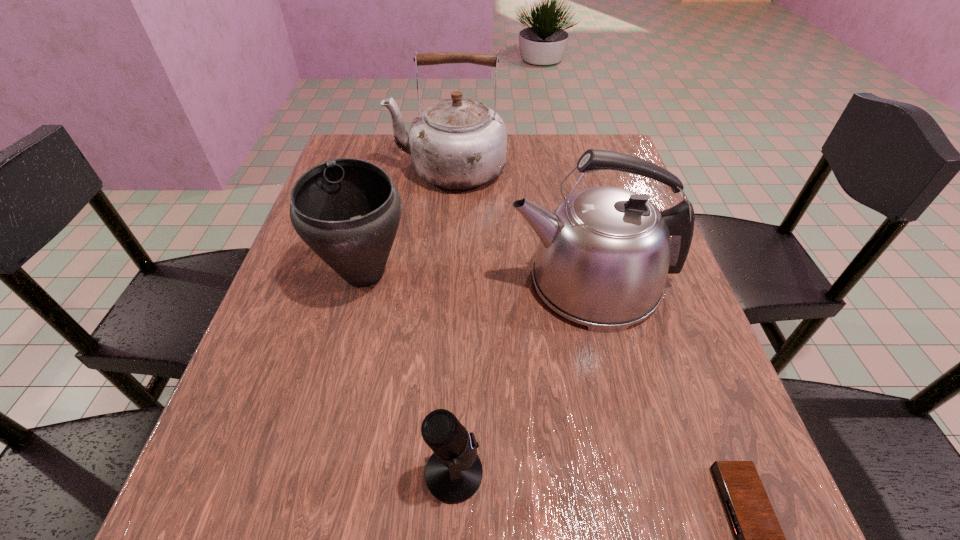
Locate an element on the screen. blank area located on the front of the urn is located at coordinates (344, 356).

Find the location of a particular element. The image size is (960, 540). free space located 0.120m on the stand of the second shortest object is located at coordinates (565, 473).

Find the location of a particular element. object located in the far edge section of the desktop is located at coordinates (458, 143).

Where is `object at the near edge`? object at the near edge is located at coordinates (453, 474).

The image size is (960, 540). What are the coordinates of `kettle at the left edge` in the screenshot? It's located at (x=458, y=143).

Find the location of a particular element. This screenshot has width=960, height=540. urn present at the left edge is located at coordinates (347, 210).

The height and width of the screenshot is (540, 960). In order to click on object present at the right edge in this screenshot , I will do `click(604, 254)`.

In order to click on object at the far left corner in this screenshot , I will do `click(458, 143)`.

Locate an element on the screen. vacant position at the near edge of the desktop is located at coordinates (544, 487).

Identify the location of vacant space at the left edge of the desktop. (322, 433).